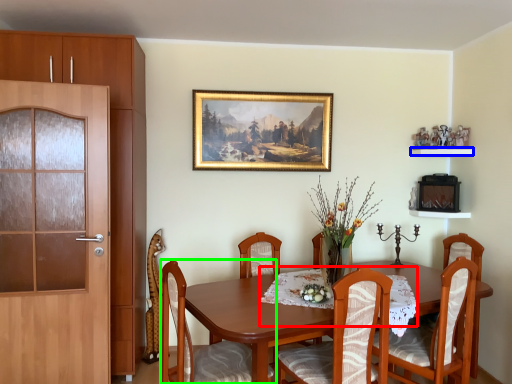
Question: Estimate the real-world distances between objects in this image. Which object is closer to tablecloth (highlighted by a red box), shelf (highlighted by a blue box) or chair (highlighted by a green box)?

Choices:
 (A) shelf
 (B) chair

Answer: (B)